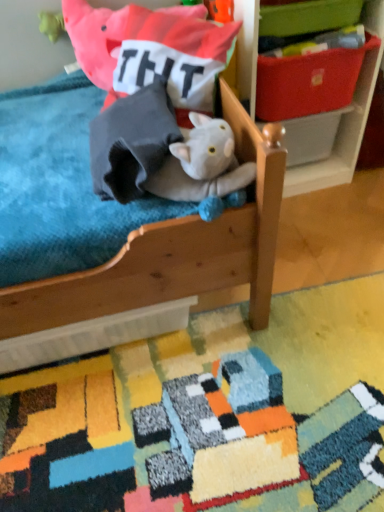
Question: Considering the positions of point (286, 184) and point (337, 120), is point (286, 184) closer or farther from the camera than point (337, 120)?

Choices:
 (A) farther
 (B) closer

Answer: (A)

Question: In terms of size, does wooden shelf at upper right appear bigger or smaller than white plastic storage box at center, which ranks as the third storage box in top-to-bottom order?

Choices:
 (A) big
 (B) small

Answer: (A)

Question: Estimate the real-world distances between objects in this image. Which object is farther from the wooden shelf at upper right?

Choices:
 (A) white plastic storage box at center, which ranks as the third storage box in top-to-bottom order
 (B) green fabric storage box at upper right, the 1th storage box positioned from the top
 (C) gray fabric stuffed animal at upper center
 (D) matte plastic storage box at upper right, placed as the 2th storage box when sorted from top to bottom
 (E) multicolored textured rug at lower center

Answer: (E)

Question: Which object is the closest to the wooden shelf at upper right?

Choices:
 (A) multicolored textured rug at lower center
 (B) matte plastic storage box at upper right, the 2th storage box ordered from the bottom
 (C) soft cotton pillow at upper center
 (D) white plastic storage box at center, the first storage box from the bottom
 (E) green fabric storage box at upper right, arranged as the 3th storage box when ordered from the bottom

Answer: (D)